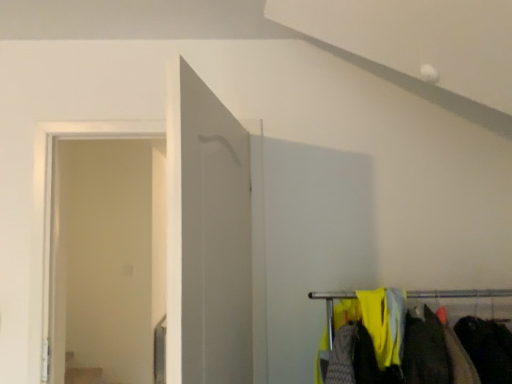
Question: From a real-world perspective, relative to white glossy door at center, is transparent glass door at left vertically above or below?

Choices:
 (A) above
 (B) below

Answer: (B)

Question: Is transparent glass door at left taller or shorter than white glossy door at center?

Choices:
 (A) short
 (B) tall

Answer: (B)

Question: Estimate the real-world distances between objects in this image. Which object is farther from the transparent glass door at left?

Choices:
 (A) dark gray fabric at lower right
 (B) white glossy door at center

Answer: (A)

Question: Estimate the real-world distances between objects in this image. Which object is farther from the transparent glass door at left?

Choices:
 (A) dark gray fabric at lower right
 (B) white glossy door at center

Answer: (A)